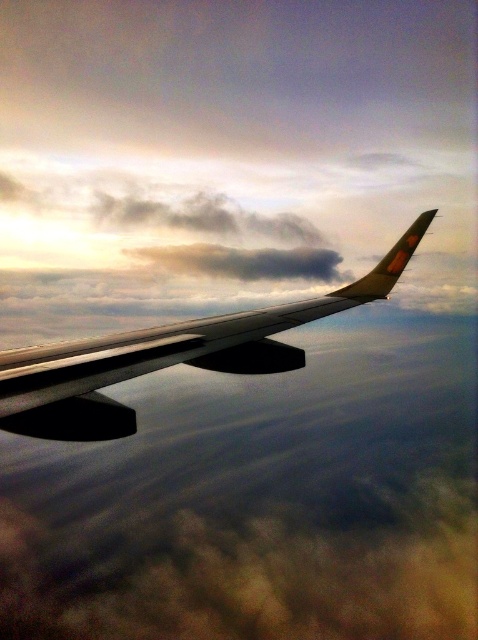
Looking at this image, is metallic silver wing at upper center in front of gray fluffy cloud at upper center?

Yes.

Looking at this image, does metallic silver wing at upper center appear over gray fluffy cloud at upper center?

Actually, metallic silver wing at upper center is below gray fluffy cloud at upper center.

Who is more distant from viewer, (393, 268) or (265, 269)?

The point (265, 269) is more distant.

Find the location of a particular element. metallic silver wing at upper center is located at coordinates (167, 356).